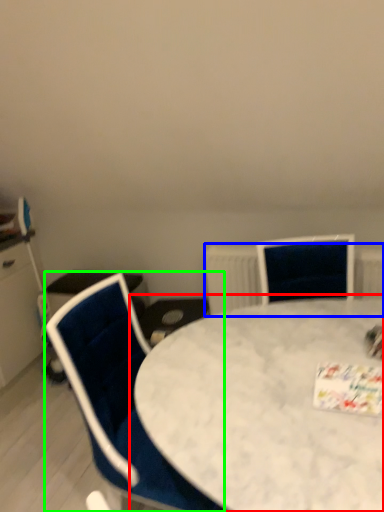
Question: Which object is positioned farthest from table (highlighted by a red box)? Select from radiator (highlighted by a blue box) and chair (highlighted by a green box).

Choices:
 (A) radiator
 (B) chair

Answer: (A)